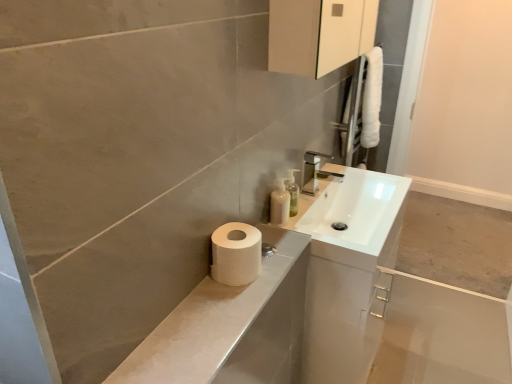
Question: Based on their positions, is translucent plastic soap dispenser at upper center located to the left or right of white matte toilet paper at lower left?

Choices:
 (A) right
 (B) left

Answer: (A)

Question: In terms of width, does translucent plastic soap dispenser at upper center look wider or thinner when compared to white matte toilet paper at lower left?

Choices:
 (A) thin
 (B) wide

Answer: (A)

Question: Which is farther from the white glossy sink at upper right?

Choices:
 (A) translucent plastic soap dispenser at upper center
 (B) white matte toilet paper at lower left
 (C) translucent plastic soap dispenser at upper right
 (D) white matte toilet paper at lower left

Answer: (D)

Question: Which object is positioned farthest from the translucent plastic soap dispenser at upper right?

Choices:
 (A) white matte toilet paper at lower left
 (B) white glossy sink at upper right
 (C) white matte toilet paper at lower left
 (D) translucent plastic soap dispenser at upper center

Answer: (A)